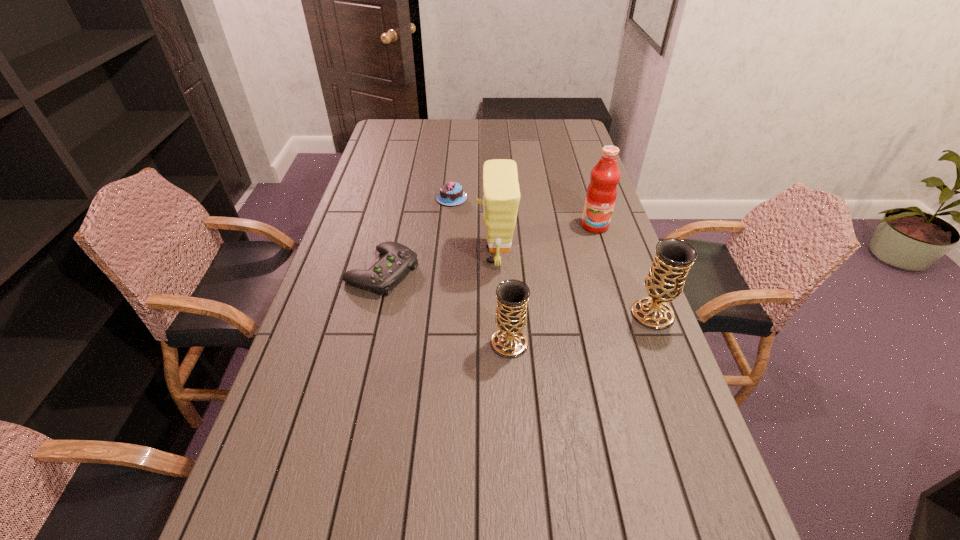
The chalices are evenly distributed in the image. To maintain this, where would you place another chalice on the left? Please point to a free space. Please provide its 2D coordinates. Your answer should be formatted as a tuple, i.e. [(x, y)], where the tuple contains the x and y coordinates of a point satisfying the conditions above.

[(347, 377)]